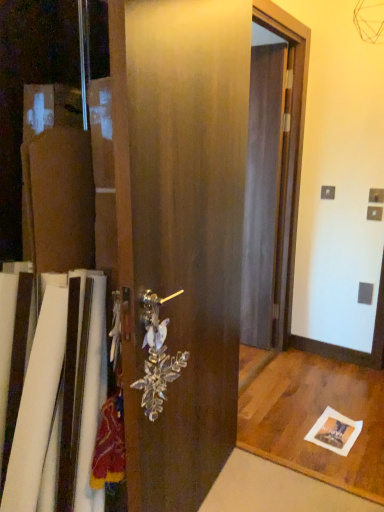
Question: From their relative heights in the image, would you say satin wood barn door at center is taller or shorter than clear crystal door handle at center?

Choices:
 (A) tall
 (B) short

Answer: (A)

Question: Is satin wood barn door at center situated inside clear crystal door handle at center or outside?

Choices:
 (A) outside
 (B) inside

Answer: (A)

Question: Which object is positioned closest to the clear crystal door handle at center?

Choices:
 (A) transparent plastic screen door at center
 (B) satin wood barn door at center

Answer: (B)

Question: Based on their relative distances, which object is nearer to the transparent plastic screen door at center?

Choices:
 (A) satin wood barn door at center
 (B) clear crystal door handle at center

Answer: (A)